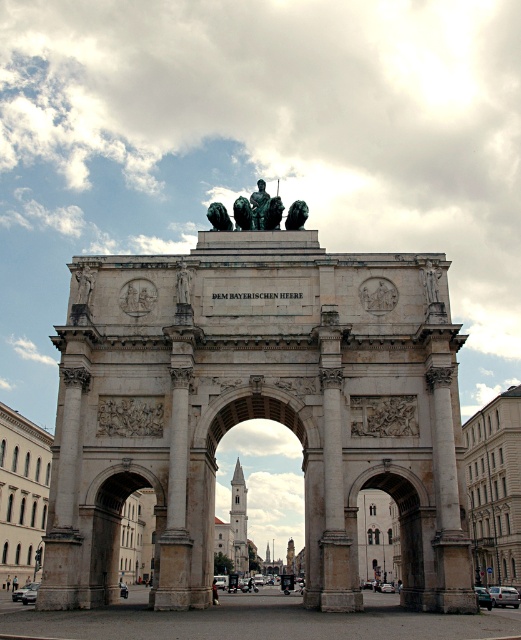
Question: Considering the real-world distances, which object is farthest from the green patina statue at center?

Choices:
 (A) bronze statue at upper left
 (B) bronze statue at center
 (C) polished stone arch at center

Answer: (A)

Question: Considering the real-world distances, which object is closest to the bronze statue at upper left?

Choices:
 (A) bronze statue at upper right
 (B) bronze statue at center
 (C) polished stone arch at center
 (D) green patina statue at center

Answer: (B)

Question: Does polished stone arch at center come behind bronze statue at upper right?

Choices:
 (A) yes
 (B) no

Answer: (B)

Question: Is polished stone arch at center above green patina statue at center?

Choices:
 (A) no
 (B) yes

Answer: (A)

Question: Does bronze statue at upper left have a larger size compared to bronze statue at center?

Choices:
 (A) yes
 (B) no

Answer: (B)

Question: Among these objects, which one is farthest from the camera?

Choices:
 (A) bronze statue at upper right
 (B) bronze statue at upper left
 (C) polished stone arch at center

Answer: (B)